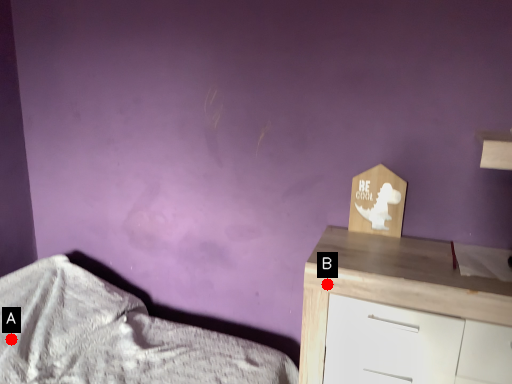
Question: Two points are circled on the image, labeled by A and B beside each circle. Among these points, which one is farthest from the camera?

Choices:
 (A) A is further
 (B) B is further

Answer: (A)